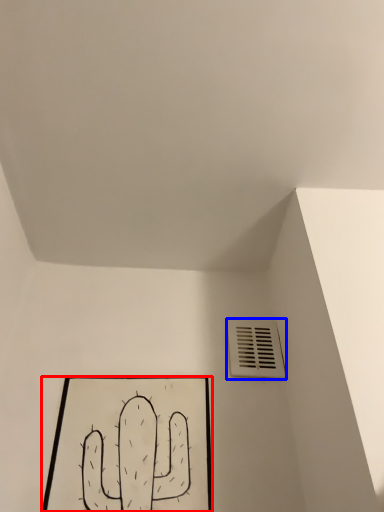
Question: Among these objects, which one is nearest to the camera, picture frame (highlighted by a red box) or air conditioning (highlighted by a blue box)?

Choices:
 (A) picture frame
 (B) air conditioning

Answer: (A)